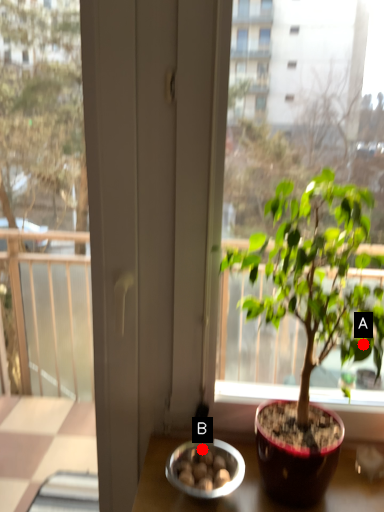
Question: Two points are circled on the image, labeled by A and B beside each circle. Which point is farther to the camera?

Choices:
 (A) A is further
 (B) B is further

Answer: (B)